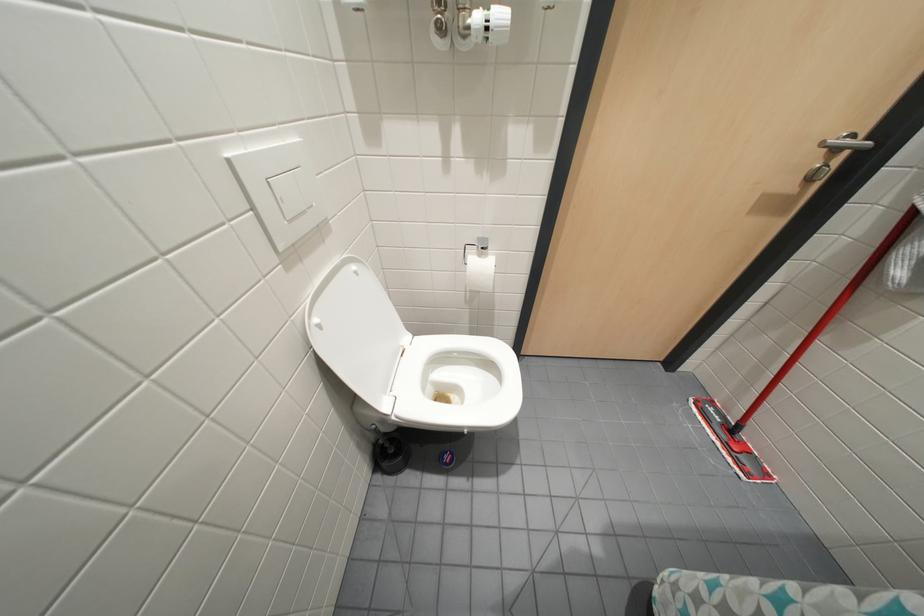
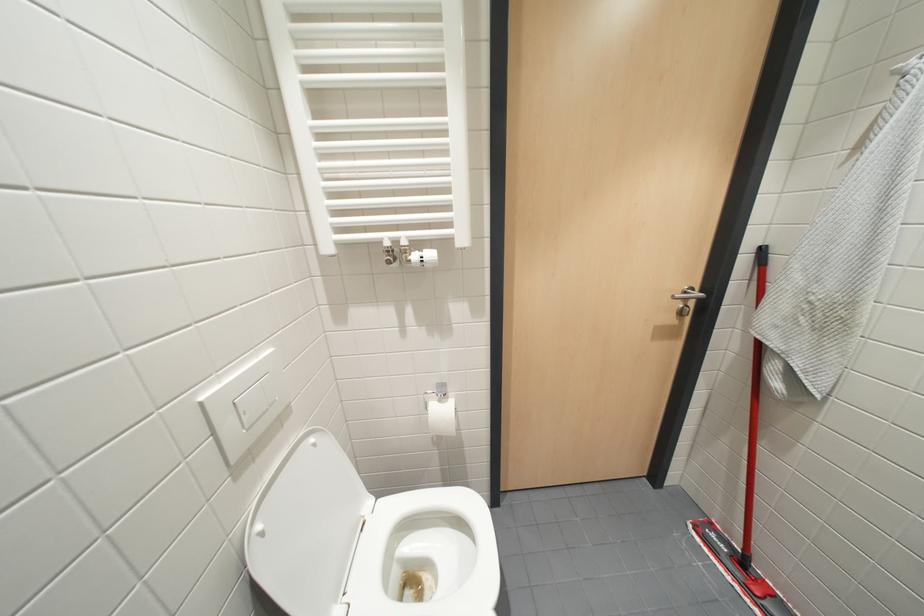
Question: How did the camera likely rotate?

Choices:
 (A) Left
 (B) Right
 (C) Up
 (D) Down

Answer: (C)